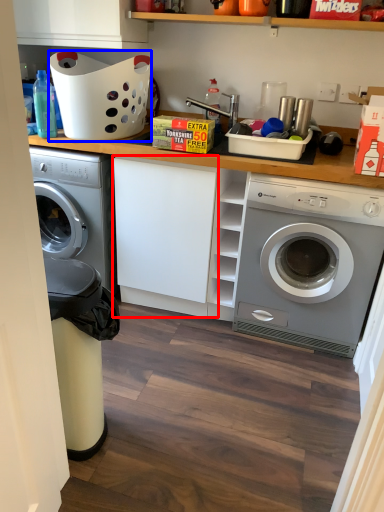
Question: Which object is further to the camera taking this photo, cabinetry (highlighted by a red box) or basket (highlighted by a blue box)?

Choices:
 (A) cabinetry
 (B) basket

Answer: (A)